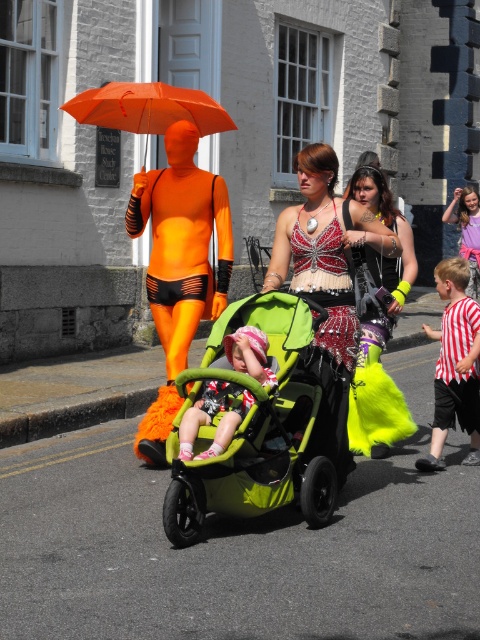
You are a photographer standing at the center of the street. You want to take a photo of the neon yellow fur coat at center. Where should you aim your camera to capture it?

You should aim your camera at point (380,326) to capture the neon yellow fur coat at center.

You are a photographer trying to capture a photo of the green matte stroller at center and the orange matte umbrella at upper center. Since you want both objects to appear equally large in the photo, which object should you move closer to?

The green matte stroller at center has a lesser width compared to orange matte umbrella at upper center, so you should move closer to the green matte stroller at center to make it appear larger in the photo.

You are a photographer trying to capture the neon yellow fur coat at center and the striped fabric shirt at right in the same frame. Which object should you focus on first to ensure both are in the frame?

You should focus on the neon yellow fur coat at center first because it is larger in size than the striped fabric shirt at right, making it easier to center and adjust the frame to include both.